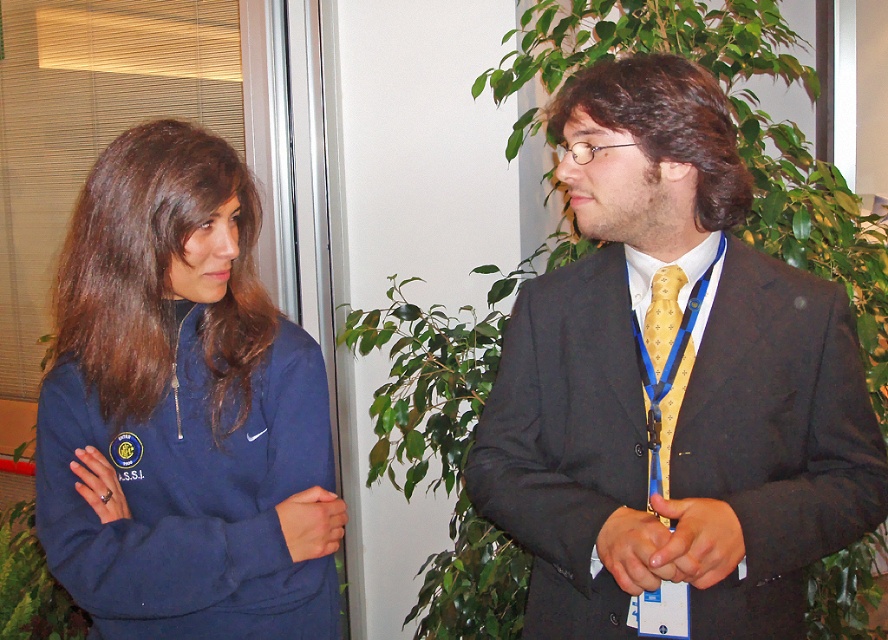
Question: Is matte black suit at center thinner than yellowtexturetie at center?

Choices:
 (A) no
 (B) yes

Answer: (A)

Question: Which object appears closest to the camera in this image?

Choices:
 (A) yellowtexturetie at center
 (B) navy fleece sweatshirt at left
 (C) matte black suit at center

Answer: (C)

Question: Does navy fleece sweatshirt at left have a lesser width compared to yellowtexturetie at center?

Choices:
 (A) yes
 (B) no

Answer: (B)

Question: Does navy fleece sweatshirt at left have a greater width compared to yellowtexturetie at center?

Choices:
 (A) yes
 (B) no

Answer: (A)

Question: Which of these objects is positioned farthest from the matte black suit at center?

Choices:
 (A) yellowtexturetie at center
 (B) navy fleece sweatshirt at left

Answer: (B)

Question: Which object appears farthest from the camera in this image?

Choices:
 (A) yellowtexturetie at center
 (B) navy fleece sweatshirt at left

Answer: (A)